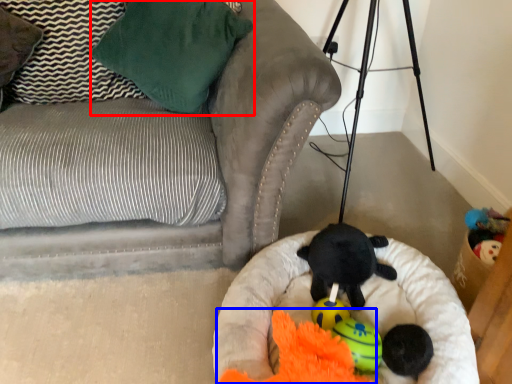
Question: Which object is further to the camera taking this photo, pillow (highlighted by a red box) or toy (highlighted by a blue box)?

Choices:
 (A) pillow
 (B) toy

Answer: (A)